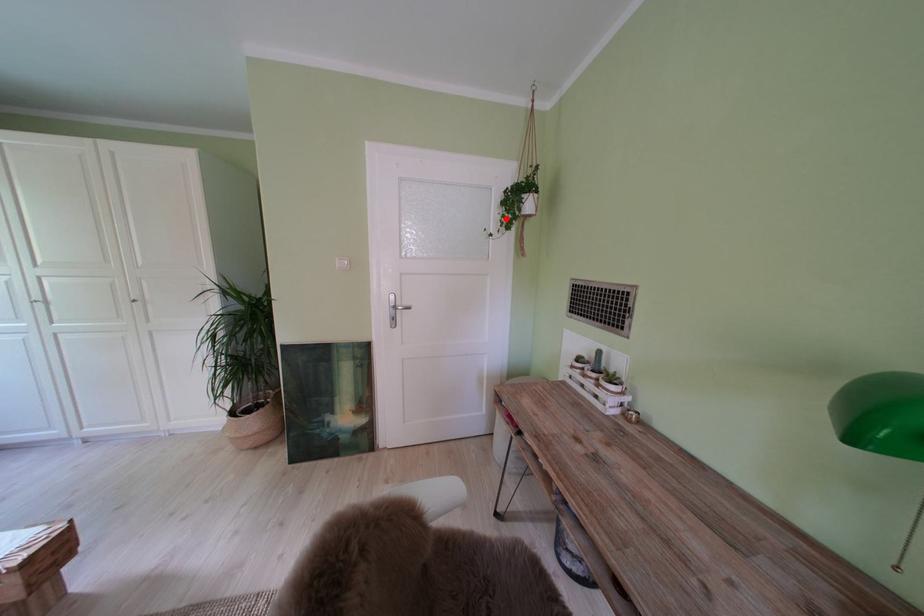
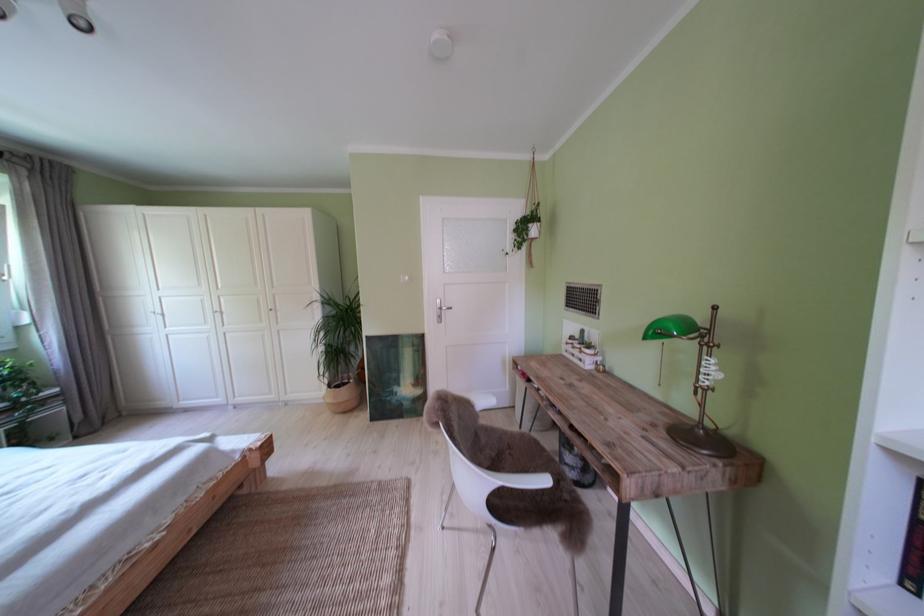
Question: I am providing you with two images of the same scene from different viewpoints. A red point is marked on the first image. Can you still see the location of the red point in image 2?

Choices:
 (A) Yes
 (B) No

Answer: (A)